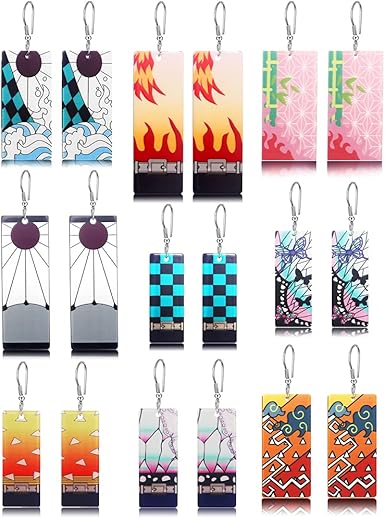
Image resolution: width=385 pixels, height=517 pixels. What are the coordinates of `hook` in the screenshot? It's located at (348, 363).